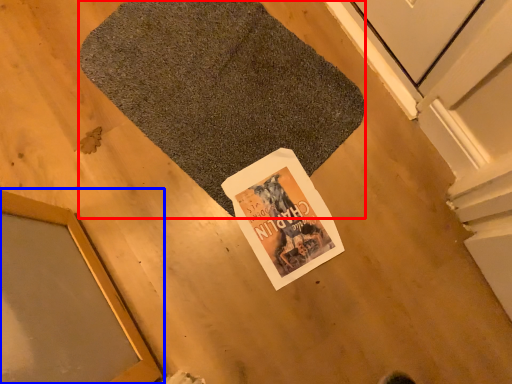
Question: Which object is closer to the camera taking this photo, bath mat (highlighted by a red box) or window (highlighted by a blue box)?

Choices:
 (A) bath mat
 (B) window

Answer: (B)